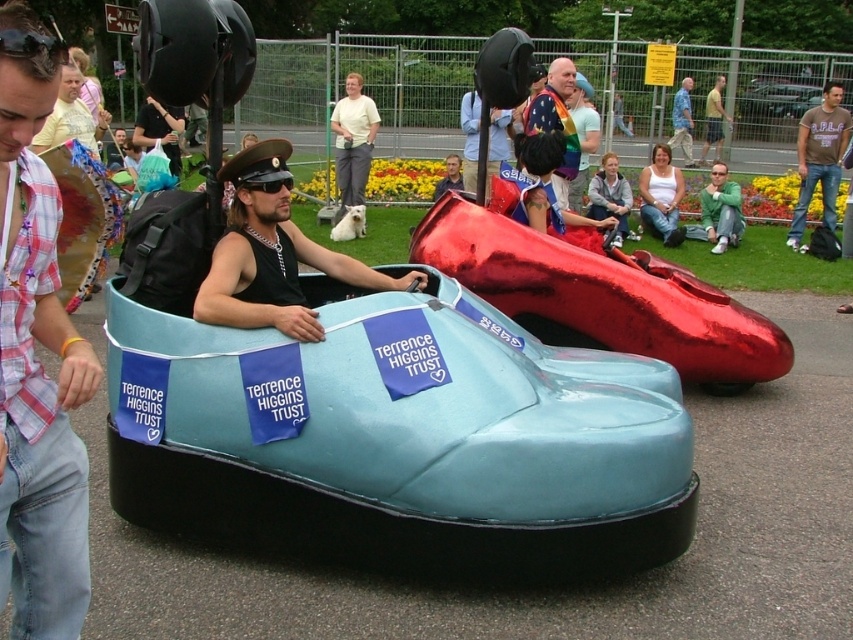
Question: Which of the following is the farthest from the observer?

Choices:
 (A) light blue fabric car at center
 (B) matte yellow dress at center
 (C) black plastic goggles at left

Answer: (A)

Question: Where is matte blue bumper car at center located in relation to black matte goggles at center in the image?

Choices:
 (A) left
 (B) right

Answer: (B)

Question: Where is glossy metallic shoe at center located in relation to metallic silver car at center in the image?

Choices:
 (A) above
 (B) below

Answer: (B)

Question: In this image, where is matte blue bumper car at center located relative to green matte jacket at center?

Choices:
 (A) left
 (B) right

Answer: (A)

Question: Based on their relative distances, which object is nearer to the white matte tank top at center?

Choices:
 (A) light blue fabric car at center
 (B) green matte jacket at center

Answer: (B)

Question: Among these objects, which one is farthest from the camera?

Choices:
 (A) rainbow flag at upper center
 (B) black plastic goggles at left

Answer: (A)